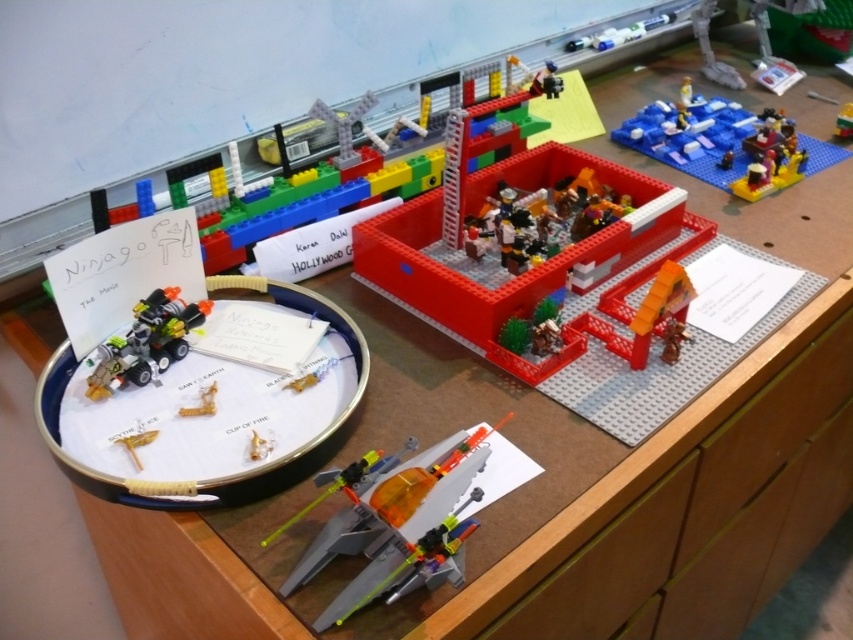
You are a child who wants to place a toy car next to the translucent orange plastic cup at lower left without moving the bright red plastic building at center. Is this possible?

The bright red plastic building at center is positioned on the right side of the translucent orange plastic cup at lower left, so there is space to the left of the cup to place the toy car without moving the building.